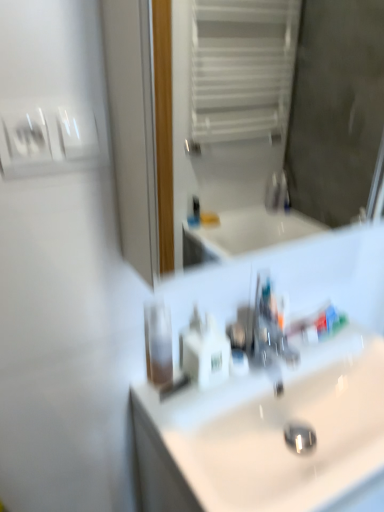
Identify the location of blank area beneath white glossy mirror at upper center (from a real-world perspective). (269, 368).